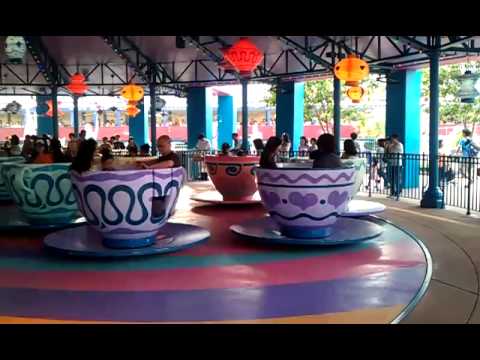
Find the location of `brown floor`. brown floor is located at coordinates (458, 267).